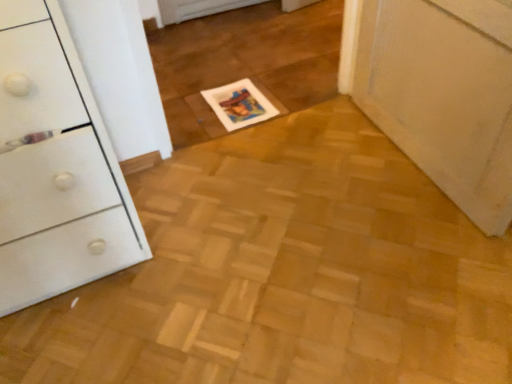
Question: Is there a large distance between white glossy chest of drawers at left and white glossy magazine at center?

Choices:
 (A) no
 (B) yes

Answer: (A)

Question: Is white glossy chest of drawers at left positioned with its back to white glossy magazine at center?

Choices:
 (A) yes
 (B) no

Answer: (B)

Question: From the image's perspective, is white glossy chest of drawers at left on white glossy magazine at center?

Choices:
 (A) yes
 (B) no

Answer: (B)

Question: Is white glossy chest of drawers at left at the left side of white glossy magazine at center?

Choices:
 (A) yes
 (B) no

Answer: (A)

Question: From a real-world perspective, is white glossy chest of drawers at left below white glossy magazine at center?

Choices:
 (A) no
 (B) yes

Answer: (A)

Question: Can you confirm if white glossy chest of drawers at left is smaller than white glossy magazine at center?

Choices:
 (A) yes
 (B) no

Answer: (B)

Question: Considering the relative sizes of white glossy magazine at center and white glossy chest of drawers at left in the image provided, is white glossy magazine at center smaller than white glossy chest of drawers at left?

Choices:
 (A) no
 (B) yes

Answer: (B)

Question: From the image's perspective, is white glossy magazine at center under white glossy chest of drawers at left?

Choices:
 (A) no
 (B) yes

Answer: (A)

Question: From a real-world perspective, is white glossy magazine at center over white glossy chest of drawers at left?

Choices:
 (A) no
 (B) yes

Answer: (A)

Question: Can you confirm if white glossy magazine at center is wider than white glossy chest of drawers at left?

Choices:
 (A) no
 (B) yes

Answer: (A)

Question: Can you confirm if white glossy magazine at center is bigger than white glossy chest of drawers at left?

Choices:
 (A) no
 (B) yes

Answer: (A)

Question: Is white glossy magazine at center positioned with its back to white glossy chest of drawers at left?

Choices:
 (A) yes
 (B) no

Answer: (B)

Question: From their relative heights in the image, would you say white glossy chest of drawers at left is taller or shorter than white glossy magazine at center?

Choices:
 (A) short
 (B) tall

Answer: (B)